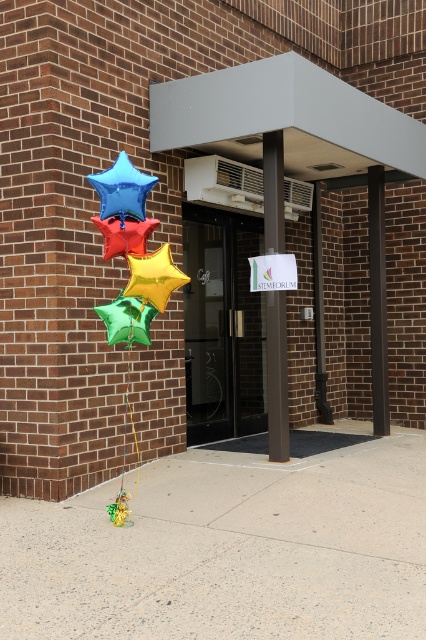
Question: Does transparent glass door at center lie behind blue metallic star at upper left?

Choices:
 (A) yes
 (B) no

Answer: (A)

Question: Which point is closer to the camera?

Choices:
 (A) rubberized red star at center
 (B) brown polished pillar at center
 (C) transparent glass door at center
 (D) blue metallic star at upper left

Answer: (D)

Question: Does concrete at center appear under metallic gold star at center?

Choices:
 (A) yes
 (B) no

Answer: (A)

Question: Observing the image, what is the correct spatial positioning of blue metallic star at upper left in reference to metallic gold star at center?

Choices:
 (A) above
 (B) below

Answer: (A)

Question: Among these points, which one is nearest to the camera?

Choices:
 (A) (118, 214)
 (B) (101, 227)

Answer: (B)

Question: Estimate the real-world distances between objects in this image. Which object is closer to the blue metallic star at upper left?

Choices:
 (A) concrete at center
 (B) brown polished pillar at center
 (C) metallic gold star at center

Answer: (C)